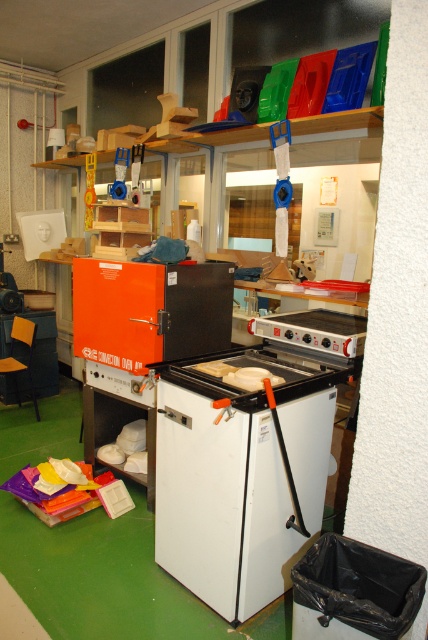
You are an artist who needs to access both the white matte refrigerator at center and the orange matte oven at center. Since you can only move one of them, which one should you move to make the other more accessible?

The white matte refrigerator at center is positioned under the orange matte oven at center. To make the oven more accessible, you should move the refrigerator since it is beneath the oven and might be blocking access to it.

What object is located at the coordinates point (240, 474) in the image?

The point (240, 474) indicates the white matte refrigerator at center.

Based on the photo, you are organizing the workshop and need to move the white matte refrigerator at center and the orange matte oven at center to a new location. If the doorway is only wide enough to allow one of them through, which appliance should you move first?

The orange matte oven at center should be moved first because it is smaller than the white matte refrigerator at center, making it easier to fit through the narrow doorway.